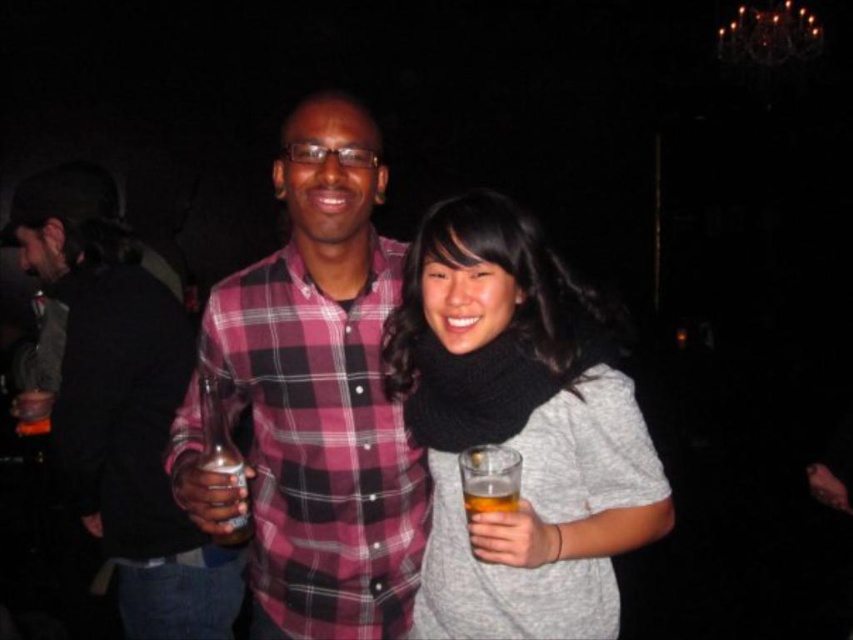
You are at a party and want to greet the person wearing the knitted black scarf at center. Which direction should you move relative to the plaid cotton shirt at center?

The plaid cotton shirt at center is to the left of the knitted black scarf at center, so you should move to the right relative to the plaid cotton shirt at center to reach the knitted black scarf at center.

You are a photographer trying to capture a clear photo of both the plaid cotton shirt at center and the knitted black scarf at center. Since the background is dark, you want to ensure neither object is obstructed. Based on their positions, can you focus on both objects without one blocking the other?

The knitted black scarf at center is behind the plaid cotton shirt at center, so focusing on both might be challenging as the scarf is partially or fully obscured by the shirt in the same plane. Adjust your angle to capture both clearly.